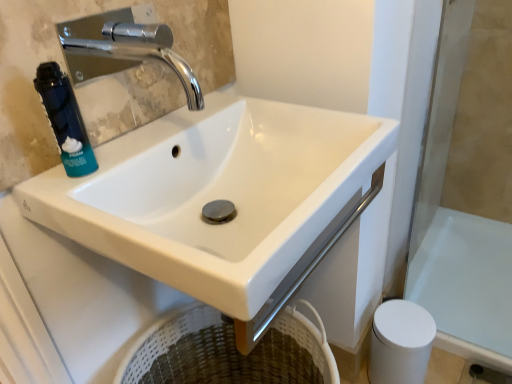
You are a GUI agent. You are given a task and a screenshot of the screen. Output one action in this format:
    pyautogui.click(x=<x>, y=<y>)
    Task: Click on the empty space that is ontop of white glossy bath at lower right (from a real-world perspective)
    The height and width of the screenshot is (384, 512).
    Given the screenshot: What is the action you would take?
    pyautogui.click(x=464, y=288)